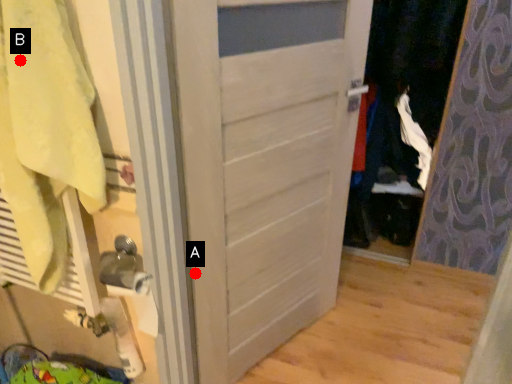
Question: Two points are circled on the image, labeled by A and B beside each circle. Which of the following is the closest to the observer?

Choices:
 (A) A is closer
 (B) B is closer

Answer: (B)